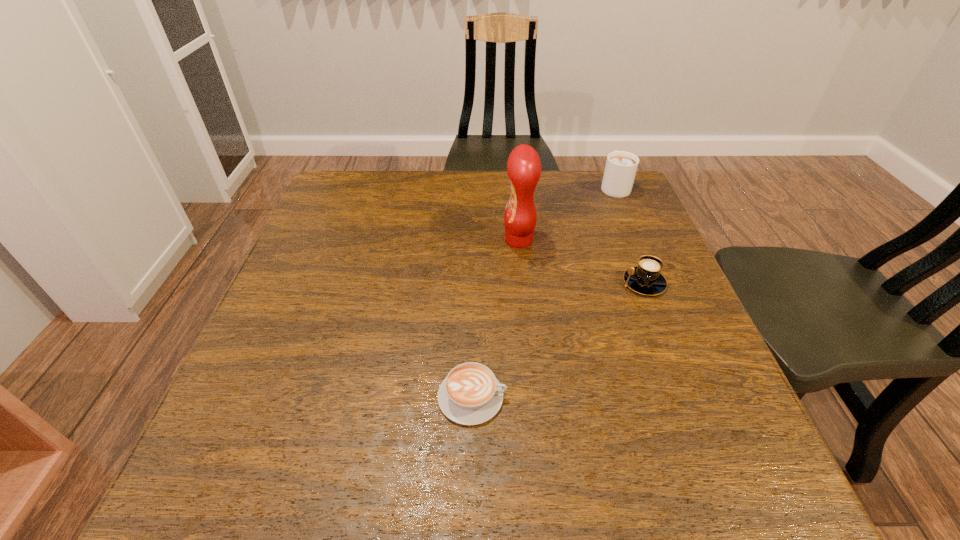
Locate an element on the screen. empty location between the third object from right to left and the second farthest cappuccino is located at coordinates (581, 261).

Identify the location of object that is the second closest to the second nearest object. The height and width of the screenshot is (540, 960). (621, 166).

You are a GUI agent. You are given a task and a screenshot of the screen. Output one action in this format:
    pyautogui.click(x=<x>, y=<y>)
    Task: Click on the object that is the third closest to the second farthest cappuccino
    
    Given the screenshot: What is the action you would take?
    pyautogui.click(x=470, y=394)

Locate an element on the screen. Image resolution: width=960 pixels, height=540 pixels. cappuccino that stands as the second closest to the second tallest object is located at coordinates (470, 394).

This screenshot has height=540, width=960. In order to click on the third closest cappuccino to the second object from left to right in this screenshot , I will do `click(470, 394)`.

At what (x,y) coordinates should I click in order to perform the action: click on free spot that satisfies the following two spatial constraints: 1. on the back side of the second tallest cappuccino; 2. on the label side of the second object from left to right. Please return your answer as a coordinate pair (x, y). This screenshot has width=960, height=540. Looking at the image, I should click on (627, 240).